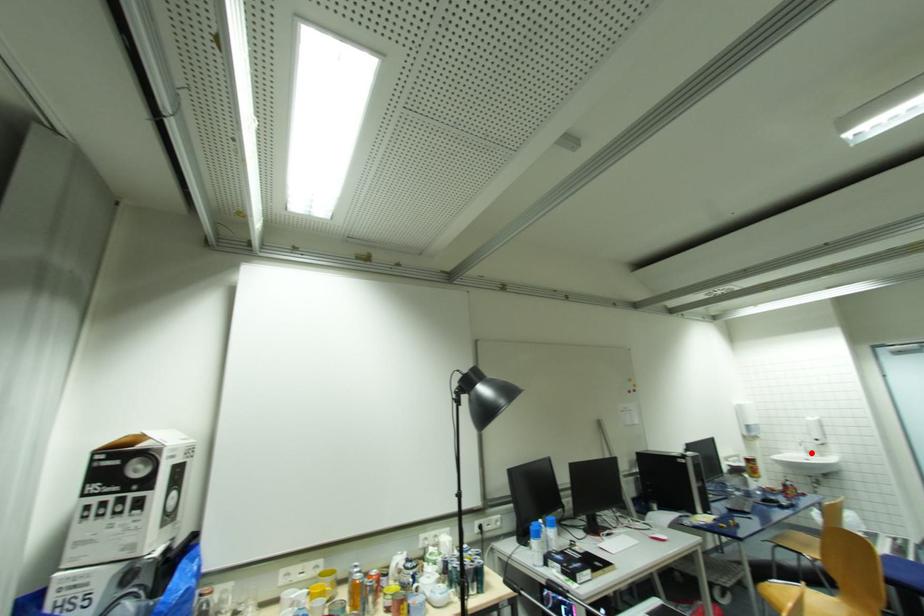
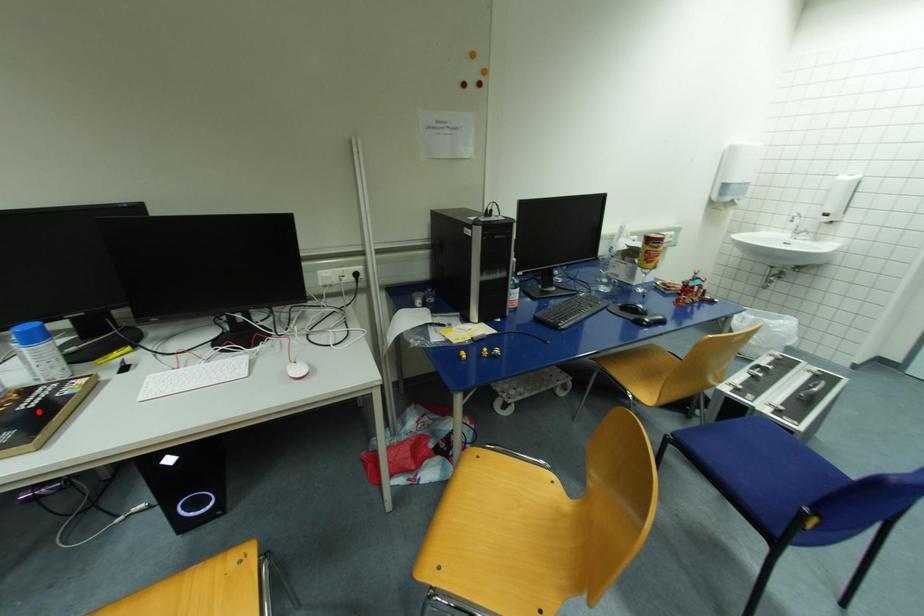
I am providing you with two images of the same scene from different viewpoints. A red point is marked on the first image and another point is marked on the second image. Is the marked point in image1 the same physical position as the marked point in image2?

No